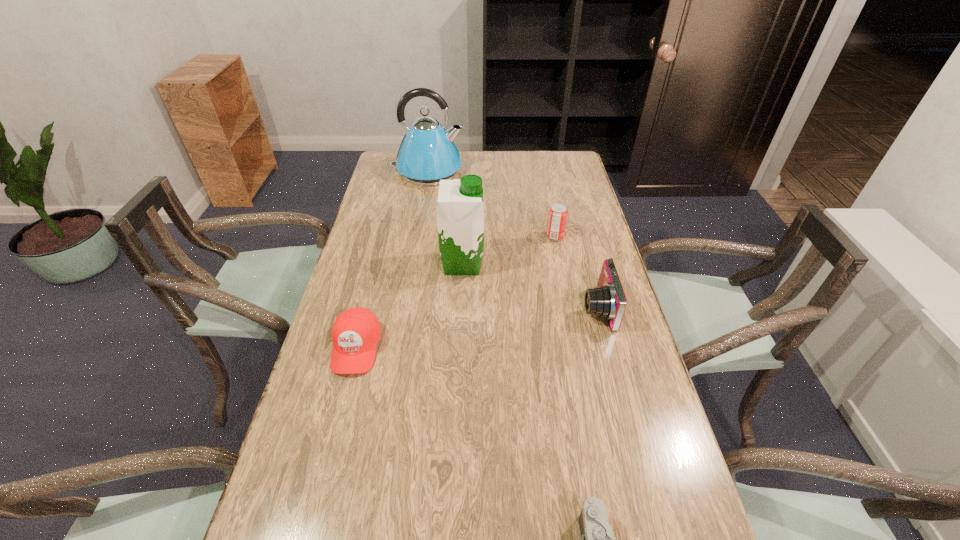
Find the location of a particular element. The height and width of the screenshot is (540, 960). the farthest object is located at coordinates (427, 154).

Find the location of a particular element. soya milk is located at coordinates (460, 209).

This screenshot has height=540, width=960. Find the location of `the second farthest object`. the second farthest object is located at coordinates (557, 218).

You are a GUI agent. You are given a task and a screenshot of the screen. Output one action in this format:
    pyautogui.click(x=<x>, y=<y>)
    Task: Click on the taller camera
    
    Given the screenshot: What is the action you would take?
    pyautogui.click(x=607, y=300)

Find the location of a particular element. The image size is (960, 540). the rightmost object is located at coordinates (607, 300).

Identify the location of the fifth tallest object. (356, 331).

Locate an element on the screen. free region located 0.400m at the spout of the kettle is located at coordinates (562, 171).

Where is `free space located 0.390m on the front-facing side of the third farthest object`? Image resolution: width=960 pixels, height=540 pixels. free space located 0.390m on the front-facing side of the third farthest object is located at coordinates (609, 264).

At what (x,y) coordinates should I click in order to perform the action: click on blank space located on the back of the fifth nearest object. Please return your answer as a coordinate pair (x, y). Looking at the image, I should click on (542, 173).

Locate an element on the screen. blank space located 0.200m on the front-facing side of the right camera is located at coordinates (510, 308).